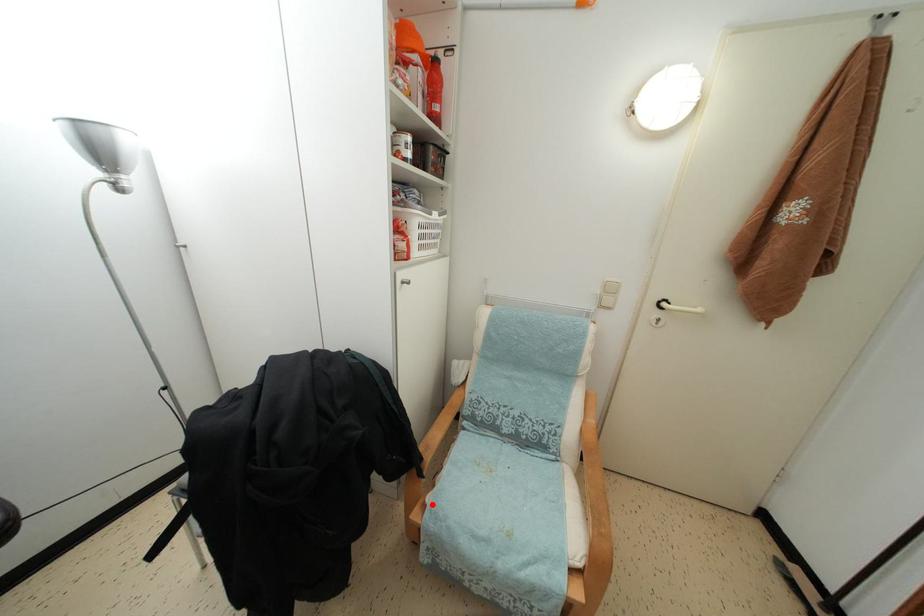
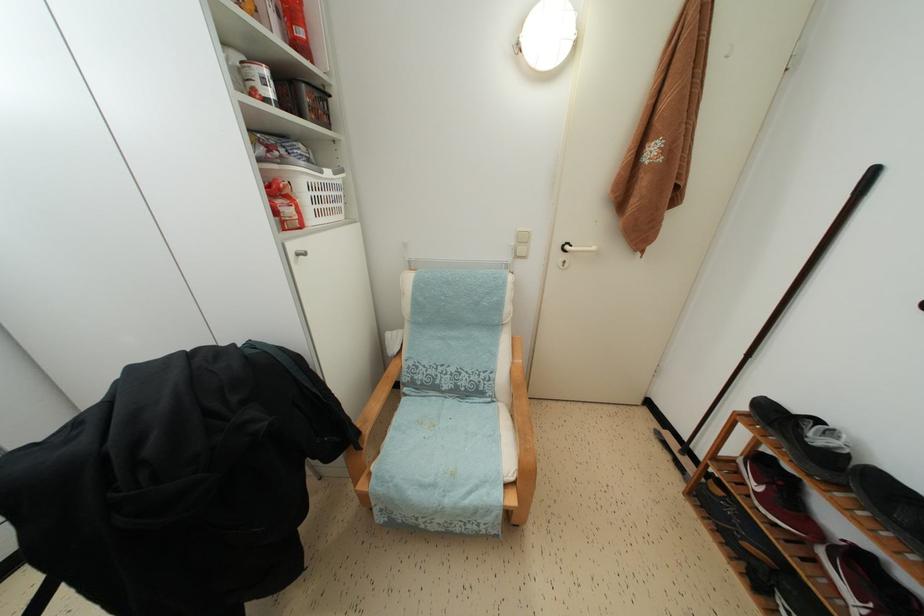
Question: I am providing you with two images of the same scene from different viewpoints. In image1, a red point is highlighted. Considering the same 3D point in image2, which of the following is correct?

Choices:
 (A) It is closer
 (B) It is farther

Answer: (B)